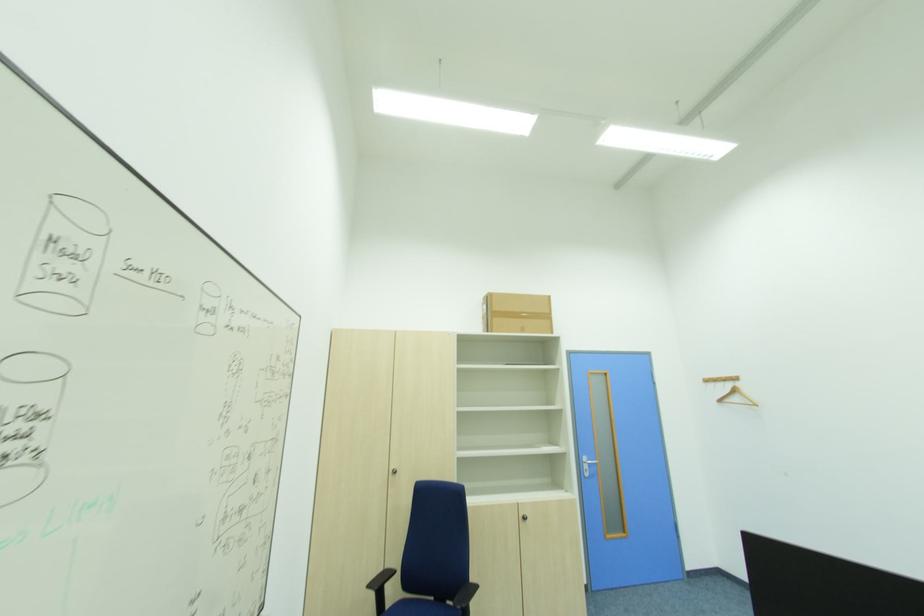
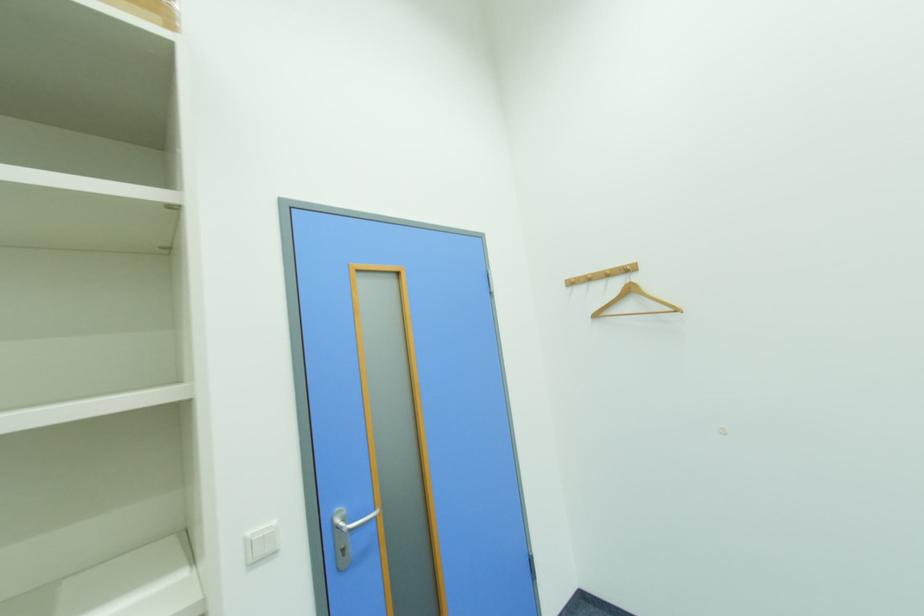
Locate, in the second image, the point that corresponds to pixel 723 403 in the first image.

(601, 317)